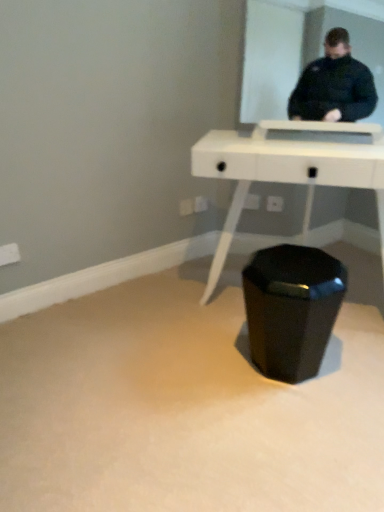
Locate an element on the screen. free spot to the right of black glossy waste container at center is located at coordinates (352, 362).